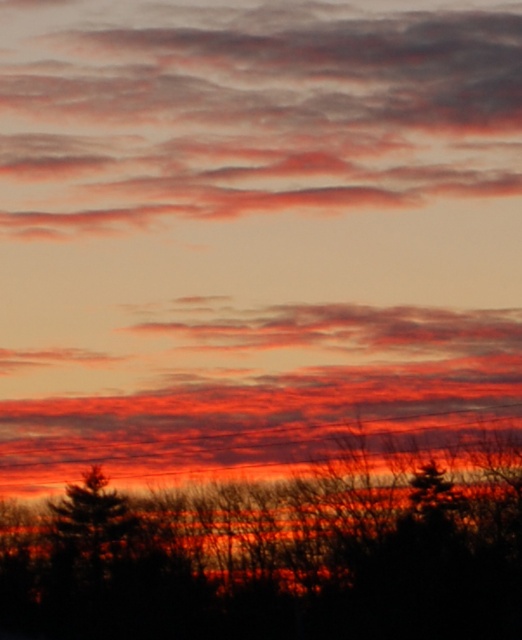
You are an artist painting the sunset scene. You want to ensure the matte orange cloud at upper center and the silhouette bare tree at bottom are positioned correctly. Based on the scene, which object should be placed higher in your painting?

The matte orange cloud at upper center should be placed higher because it is above the silhouette bare tree at bottom in the scene.

You are an artist planning to paint the sunset scene. You want to ensure the matte orange cloud at upper center and the green matte tree at lower left are proportionally accurate. Which object should you make wider in your painting?

The matte orange cloud at upper center should be made wider in the painting since its width surpasses that of the green matte tree at lower left.

You are an artist trying to paint the sunset scene. You need to decide the vertical positioning of the matte orange cloud at upper center and the green matte tree at lower left. Based on the scene, which object should be placed higher in your painting?

The matte orange cloud at upper center should be placed higher in the painting since it is much taller than the green matte tree at lower left.